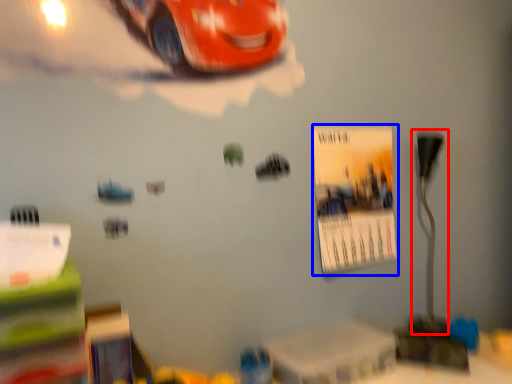
Question: Which point is further to the camera, table lamp (highlighted by a red box) or poster page (highlighted by a blue box)?

Choices:
 (A) table lamp
 (B) poster page

Answer: (A)